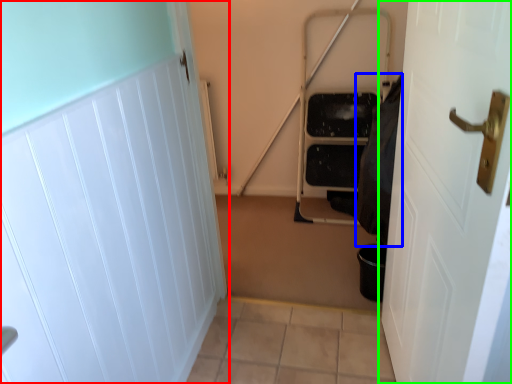
Question: Estimate the real-world distances between objects in this image. Which object is closer to door (highlighted by a red box), material (highlighted by a blue box) or door (highlighted by a green box)?

Choices:
 (A) material
 (B) door

Answer: (B)